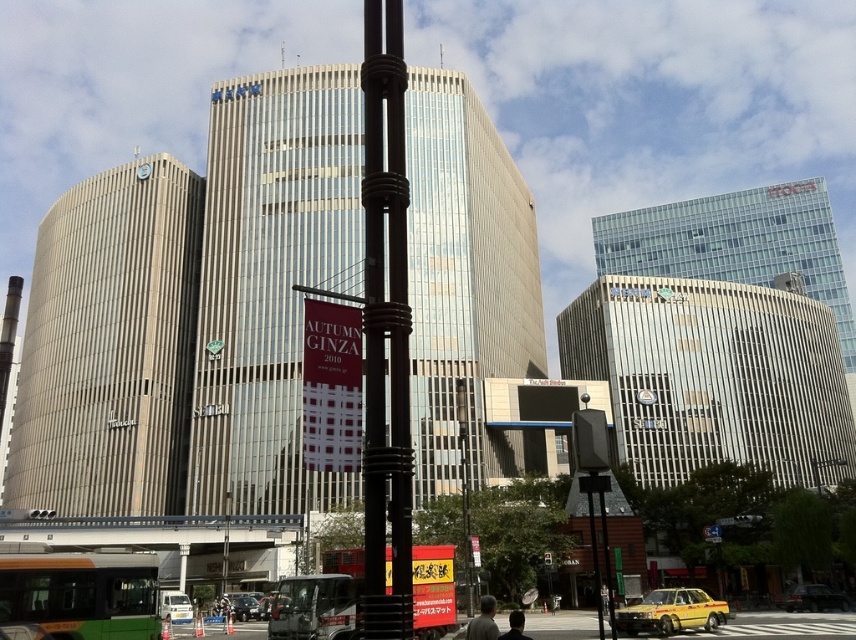
Can you confirm if metallic silver car at center is wider than black metal pole at center?

In fact, metallic silver car at center might be narrower than black metal pole at center.

Is metallic silver car at center bigger than black metal pole at center?

No.

The height and width of the screenshot is (640, 856). What do you see at coordinates (244, 605) in the screenshot?
I see `metallic silver car at center` at bounding box center [244, 605].

Where is `metallic silver car at center`? metallic silver car at center is located at coordinates (244, 605).

Does green matte bus at lower left appear over metallic silver bus at lower center?

Yes.

Is point (111, 600) closer to camera compared to point (287, 620)?

Yes, point (111, 600) is in front of point (287, 620).

Find the location of `green matte bus at lower left`. green matte bus at lower left is located at coordinates (82, 593).

Is metallic silver bus at lower center smaller than white matte van at center?

Incorrect, metallic silver bus at lower center is not smaller in size than white matte van at center.

Is metallic silver bus at lower center shorter than white matte van at center?

In fact, metallic silver bus at lower center may be taller than white matte van at center.

Image resolution: width=856 pixels, height=640 pixels. Describe the element at coordinates (313, 608) in the screenshot. I see `metallic silver bus at lower center` at that location.

Locate an element on the screen. metallic silver bus at lower center is located at coordinates (313, 608).